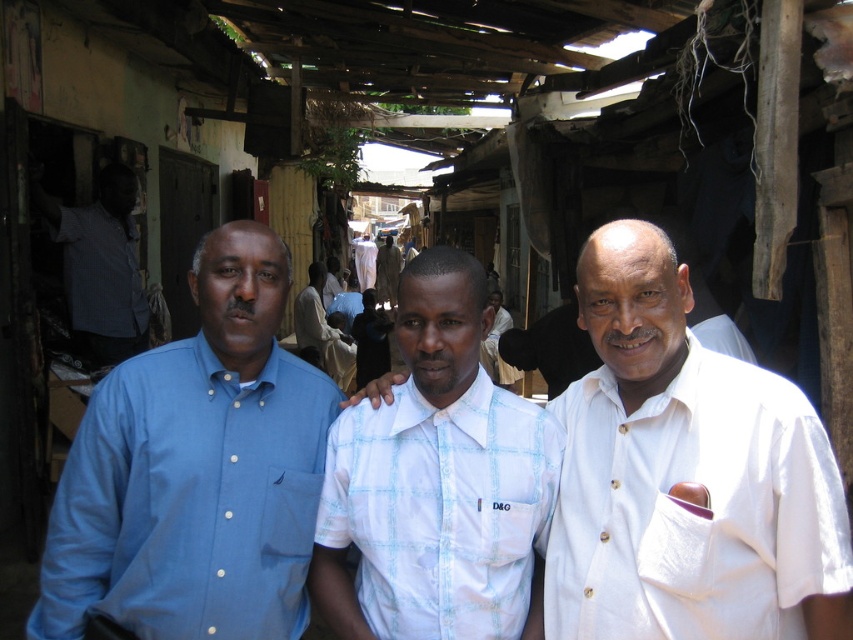
Question: Is matte blue shirt at left below white cotton shirt at center?

Choices:
 (A) yes
 (B) no

Answer: (A)

Question: Which point is closer to the camera taking this photo?

Choices:
 (A) (608, 609)
 (B) (79, 563)
 (C) (402, 636)
 (D) (577, 577)

Answer: (A)

Question: Among these points, which one is nearest to the camera?

Choices:
 (A) (590, 611)
 (B) (524, 540)
 (C) (662, 442)

Answer: (A)

Question: Does white cotton shirt at right come in front of white cotton shirt at center?

Choices:
 (A) yes
 (B) no

Answer: (A)

Question: Is matte blue shirt at left to the left of white checkered shirt at center from the viewer's perspective?

Choices:
 (A) no
 (B) yes

Answer: (B)

Question: Estimate the real-world distances between objects in this image. Which object is closer to the matte blue shirt at left?

Choices:
 (A) blue shirt at left
 (B) white checkered shirt at center
 (C) white cotton shirt at right
 (D) white cotton shirt at center

Answer: (B)